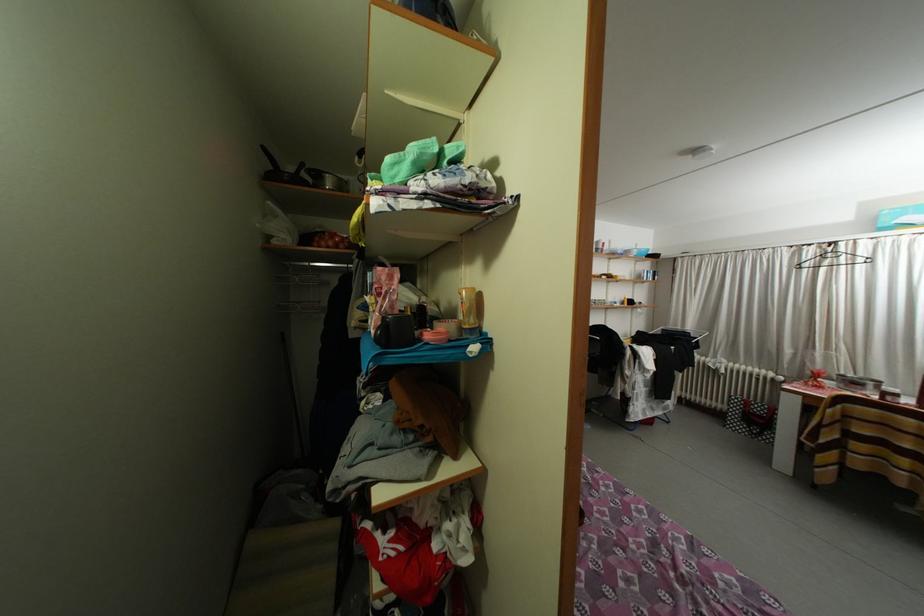
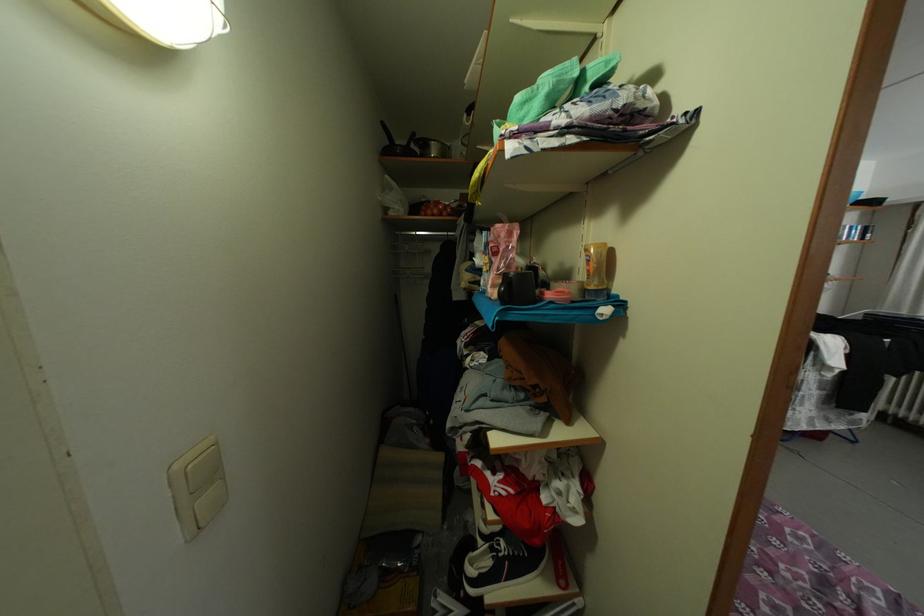
Locate, in the second image, the point that corresponds to the point at 430,339 in the first image.

(551, 299)